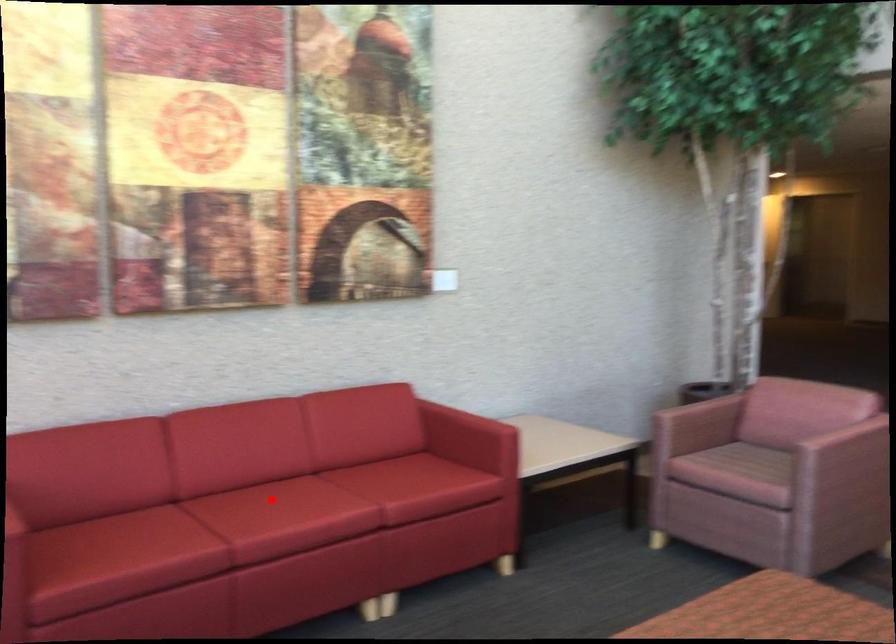
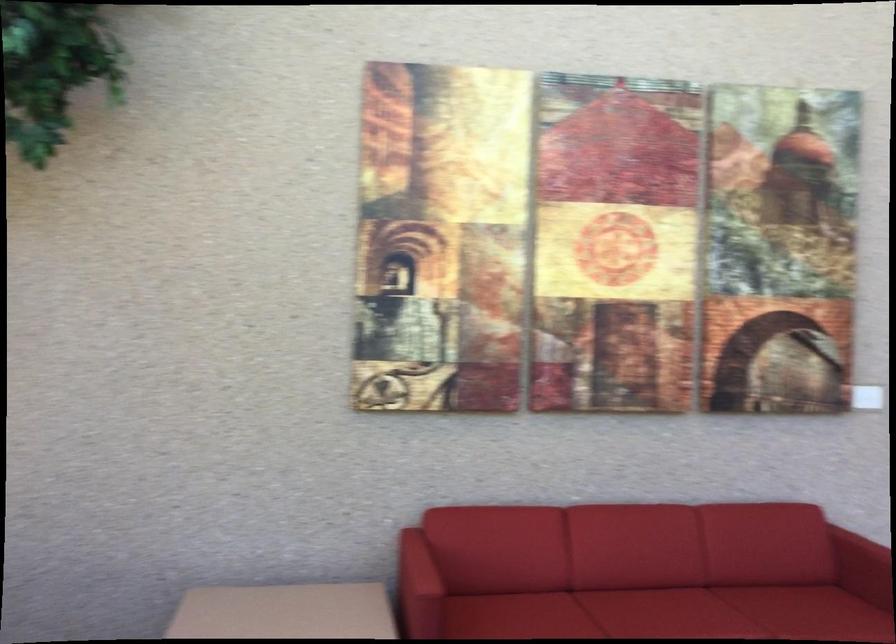
In the second image, find the point that corresponds to the highlighted location in the first image.

(659, 607)